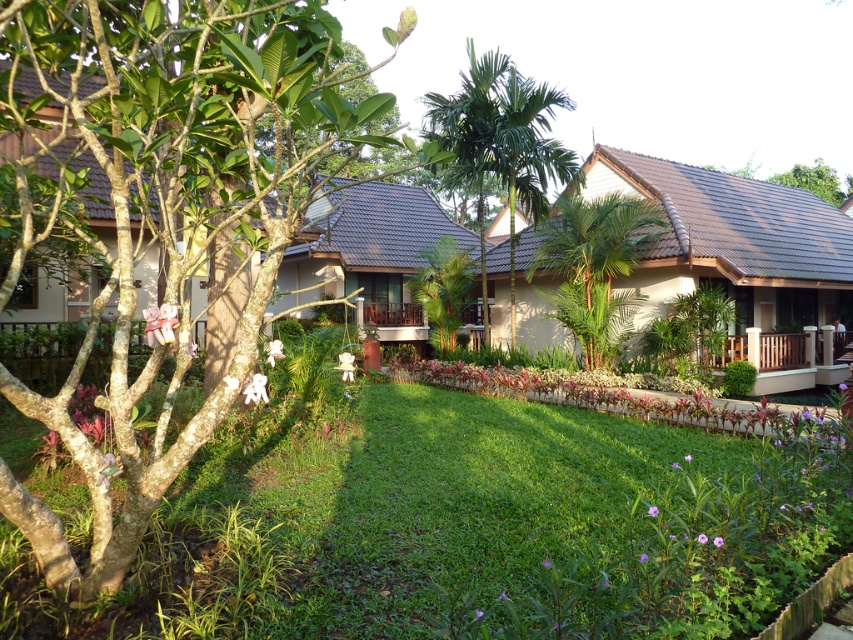
Who is higher up, green leafy palm tree at center or green leafy tree at upper right?

green leafy tree at upper right

Does green leafy palm tree at center have a greater height compared to green leafy tree at upper right?

Yes, green leafy palm tree at center is taller than green leafy tree at upper right.

Which is in front, point (480, 138) or point (804, 173)?

Point (480, 138) is more forward.

Find the location of `green leafy palm tree at center`. green leafy palm tree at center is located at coordinates (502, 141).

Which is above, green grass at center or green leafy tree at upper right?

green leafy tree at upper right is above.

How distant is green grass at center from green leafy tree at upper right?

green grass at center and green leafy tree at upper right are 202.83 feet apart from each other.

Does point (648, 422) come behind point (843, 195)?

No, it is not.

Identify the location of green grass at center. The height and width of the screenshot is (640, 853). (467, 525).

Does green leafy palm at center have a greater height compared to green leafy tree at center?

Indeed, green leafy palm at center has a greater height compared to green leafy tree at center.

Does point (612, 336) come behind point (445, 330)?

No, (612, 336) is in front of (445, 330).

Identify the location of green leafy palm at center. The image size is (853, 640). (595, 266).